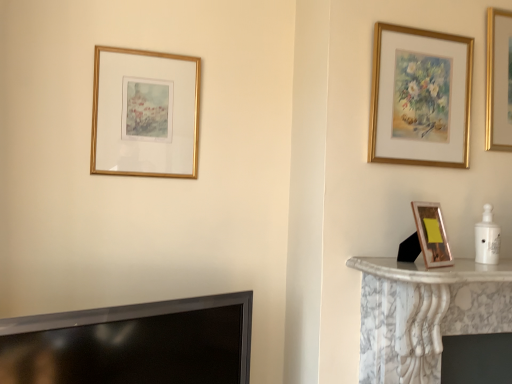
Question: Could you tell me if gold-framed painting at upper right, which is counted as the 2th picture frame, starting from the front, is turned towards black glossy tv at lower left?

Choices:
 (A) no
 (B) yes

Answer: (A)

Question: From the image's perspective, is gold-framed painting at upper right, which appears as the first picture frame when viewed from the right, below black glossy tv at lower left?

Choices:
 (A) no
 (B) yes

Answer: (A)

Question: Does gold-framed painting at upper right, which is counted as the 2th picture frame, starting from the front, lie behind black glossy tv at lower left?

Choices:
 (A) no
 (B) yes

Answer: (B)

Question: From a real-world perspective, is gold-framed painting at upper right, which ranks as the second picture frame in back-to-front order, beneath black glossy tv at lower left?

Choices:
 (A) no
 (B) yes

Answer: (A)

Question: Is gold-framed painting at upper right, which is counted as the 2th picture frame, starting from the front, smaller than black glossy tv at lower left?

Choices:
 (A) no
 (B) yes

Answer: (B)

Question: Is gold-framed painting at upper right, which is counted as the 2th picture frame, starting from the front, positioned beyond the bounds of black glossy tv at lower left?

Choices:
 (A) yes
 (B) no

Answer: (A)

Question: Is gold metallic picture frame at right, the second picture frame from the right, smaller than gold-framed picture at upper left, marked as the first picture frame in a back-to-front arrangement?

Choices:
 (A) no
 (B) yes

Answer: (B)

Question: Is gold metallic picture frame at right, the 3th picture frame positioned from the back, further to camera compared to gold-framed picture at upper left, marked as the first picture frame in a back-to-front arrangement?

Choices:
 (A) yes
 (B) no

Answer: (B)

Question: Is gold-framed picture at upper left, the third picture frame positioned from the front, a part of gold metallic picture frame at right, which is counted as the 1th picture frame, starting from the front?

Choices:
 (A) no
 (B) yes

Answer: (A)

Question: Is gold metallic picture frame at right, the 3th picture frame positioned from the back, bigger than gold-framed picture at upper left, marked as the third picture frame in a right-to-left arrangement?

Choices:
 (A) yes
 (B) no

Answer: (B)

Question: Is gold metallic picture frame at right, the second picture frame from the right, touching gold-framed picture at upper left, marked as the first picture frame in a back-to-front arrangement?

Choices:
 (A) yes
 (B) no

Answer: (B)

Question: Is gold metallic picture frame at right, which ranks as the 2th picture frame in left-to-right order, positioned before gold-framed picture at upper left, which is the first picture frame in left-to-right order?

Choices:
 (A) no
 (B) yes

Answer: (B)

Question: From a real-world perspective, is gold-framed picture at upper left, marked as the third picture frame in a right-to-left arrangement, on top of gold-framed painting at upper right, which appears as the first picture frame when viewed from the right?

Choices:
 (A) no
 (B) yes

Answer: (A)